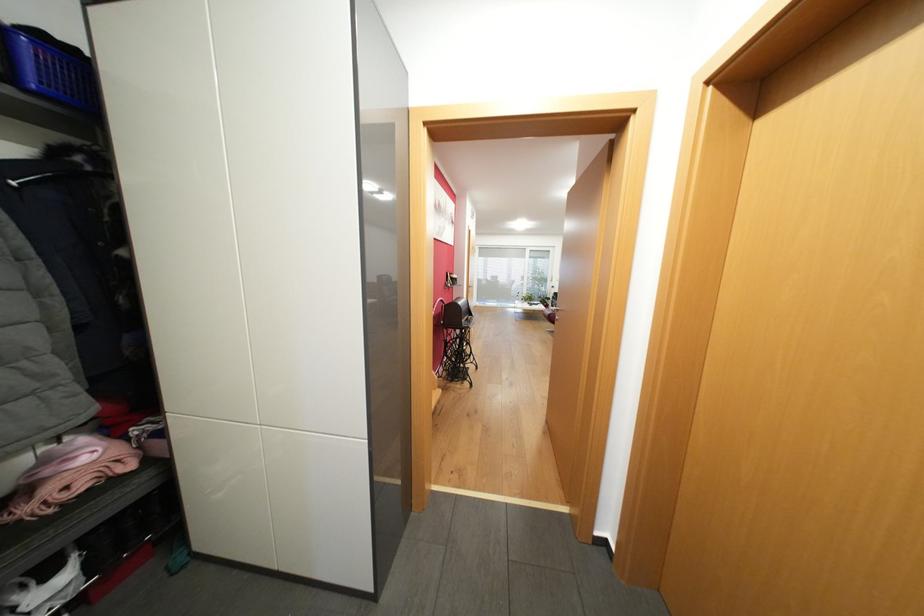
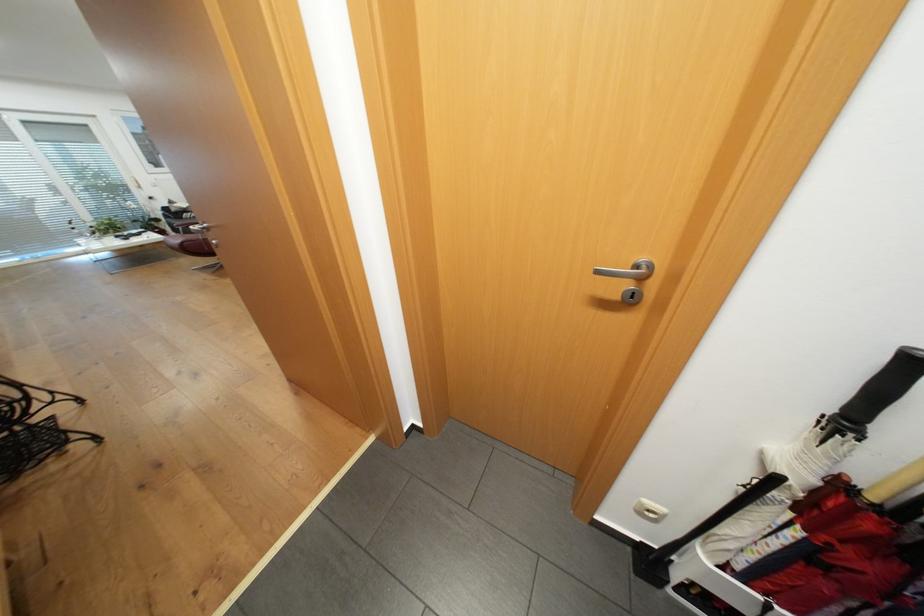
Locate, in the second image, the point that corresponds to the point at 478,384 in the first image.

(102, 438)